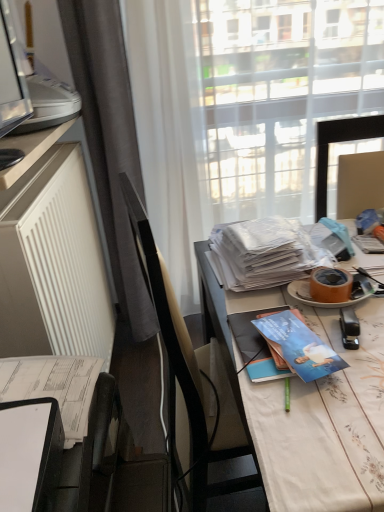
Question: Relative to matte brown adhesive tape at right, is white glossy magazine at center, acting as the 1th magazine starting from the top, in front or behind?

Choices:
 (A) behind
 (B) front

Answer: (A)

Question: Considering the relative positions of white glossy magazine at center, which is the second magazine in bottom-to-top order, and matte brown adhesive tape at right in the image provided, is white glossy magazine at center, which is the second magazine in bottom-to-top order, to the left or to the right of matte brown adhesive tape at right?

Choices:
 (A) right
 (B) left

Answer: (B)

Question: Which of these objects is positioned closest to the white glossy desk at center, which is the first desk in bottom-to-top order?

Choices:
 (A) blue glossy book at center
 (B) blue glossy book at center, the second magazine positioned from the top
 (C) white glossy magazine at center, which is the second magazine in bottom-to-top order
 (D) white paper journal at lower left
 (E) matte brown adhesive tape at right

Answer: (A)

Question: Considering the real-world distances, which object is closest to the white glossy desk at center, which is the first desk in bottom-to-top order?

Choices:
 (A) orange matte plate at right
 (B) matte black monitor at left, positioned as the second desk in right-to-left order
 (C) blue glossy book at center
 (D) white glossy magazine at center, the 1th magazine when ordered from back to front
 (E) translucent fabric at center

Answer: (C)